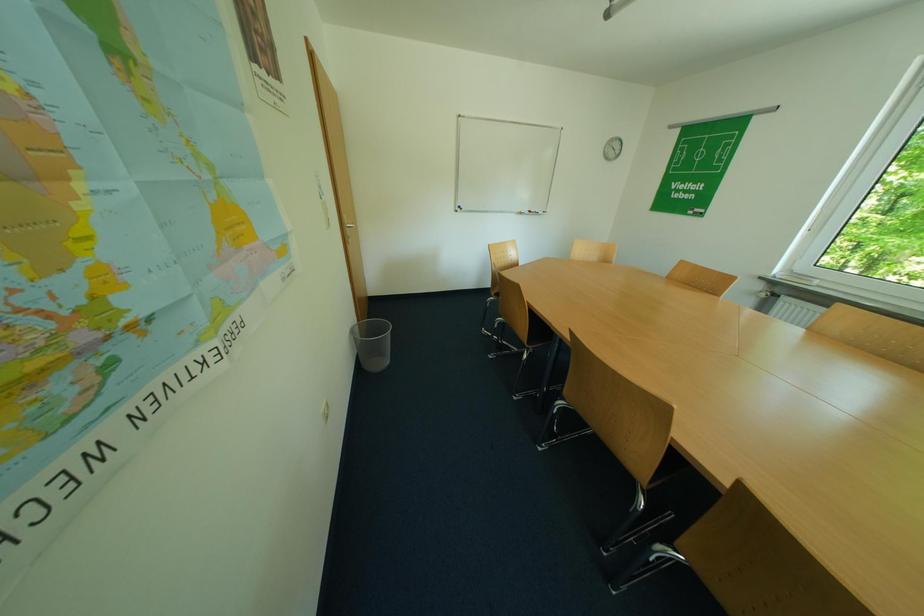
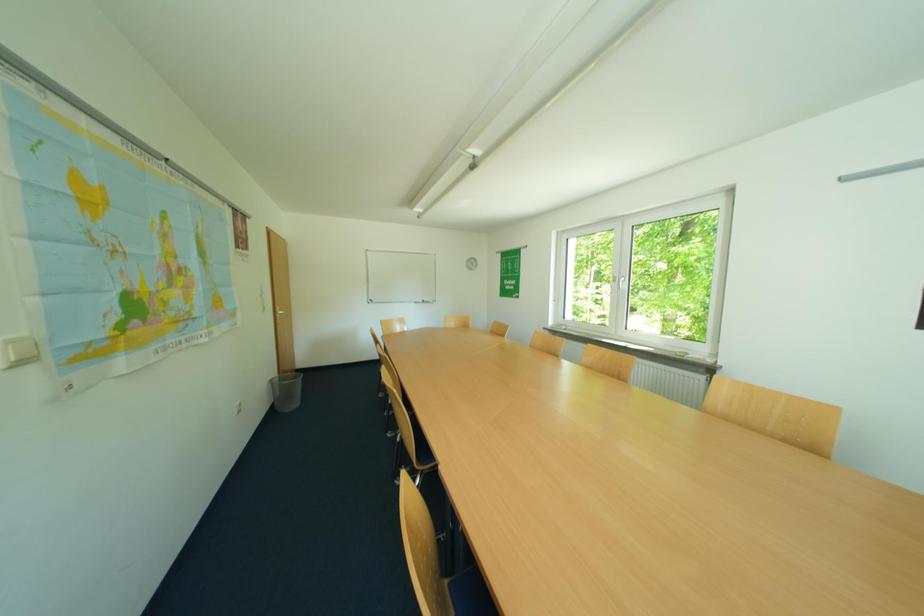
The images are taken continuously from a first-person perspective. In which direction are you moving?

The cameraman walked toward right, backward.